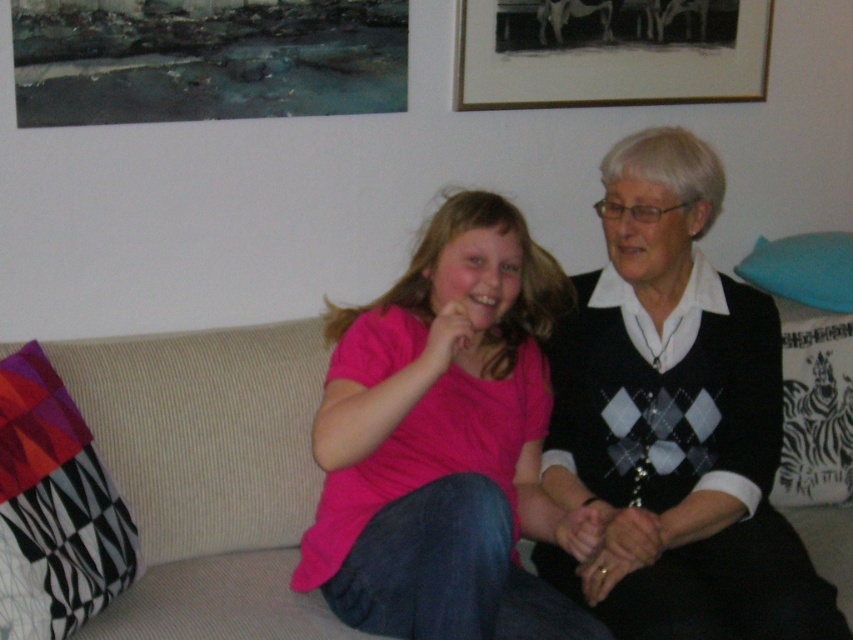
Does black sweater at right have a lesser width compared to black matte picture frame at upper center?

Correct, black sweater at right's width is less than black matte picture frame at upper center's.

Where is `black sweater at right`? The image size is (853, 640). black sweater at right is located at coordinates (674, 420).

Which is more to the right, black sweater at right or pink matte shirt at center?

Positioned to the right is black sweater at right.

Does black sweater at right appear on the left side of pink matte shirt at center?

In fact, black sweater at right is to the right of pink matte shirt at center.

What do you see at coordinates (674, 420) in the screenshot? I see `black sweater at right` at bounding box center [674, 420].

The width and height of the screenshot is (853, 640). In order to click on black sweater at right in this screenshot , I will do `click(674, 420)`.

In order to click on pink matte shirt at center in this screenshot , I will do `click(444, 442)`.

Which is below, pink matte shirt at center or black matte picture frame at upper center?

pink matte shirt at center is lower down.

The height and width of the screenshot is (640, 853). What do you see at coordinates (444, 442) in the screenshot?
I see `pink matte shirt at center` at bounding box center [444, 442].

Locate an element on the screen. The image size is (853, 640). pink matte shirt at center is located at coordinates (444, 442).